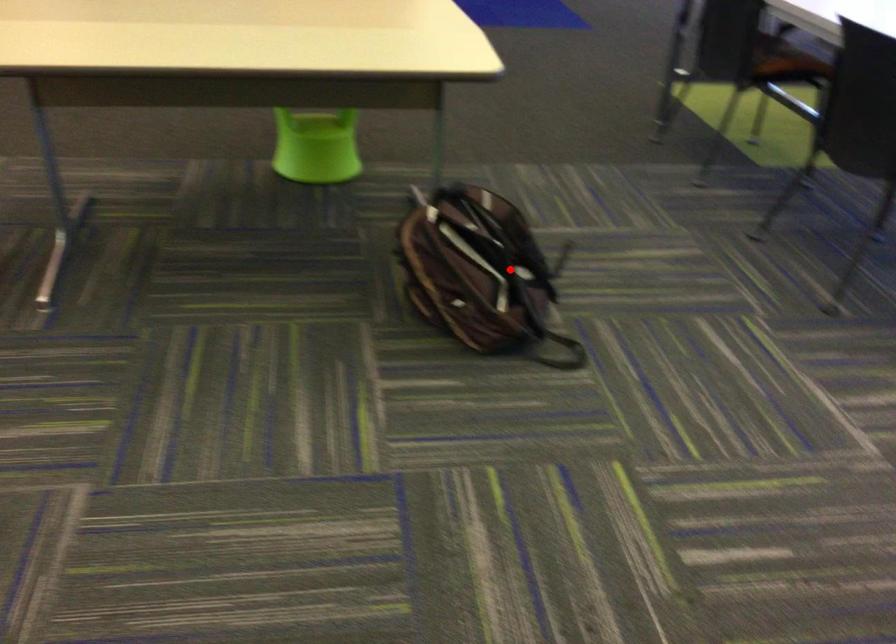
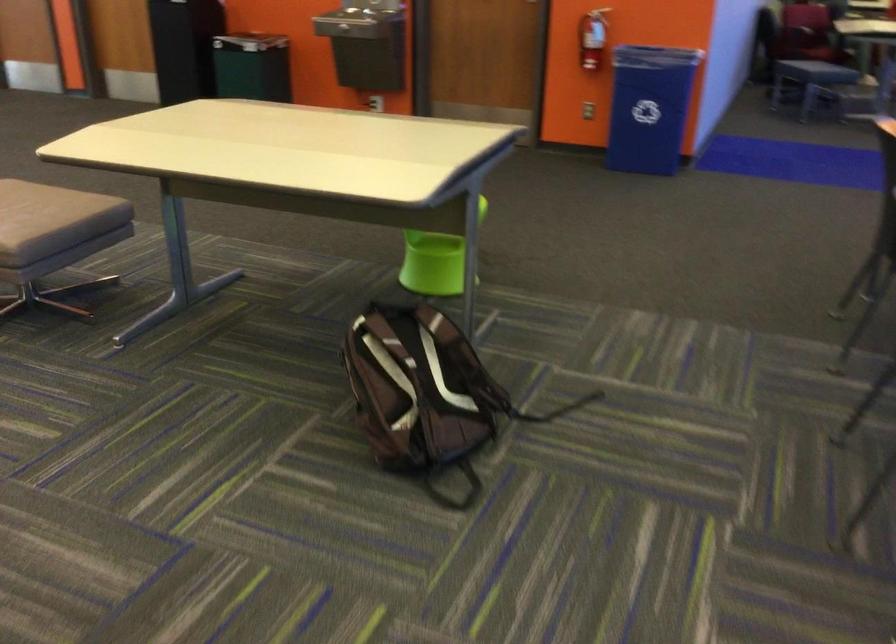
Where in the second image is the point corresponding to the highlighted location from the first image?

(419, 392)